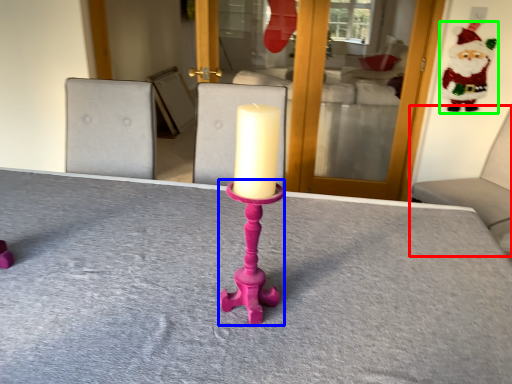
Question: Which object is the farthest from furniture (highlighted by a red box)? Choose among these: candle holder (highlighted by a blue box) or santa claus (highlighted by a green box).

Choices:
 (A) candle holder
 (B) santa claus

Answer: (A)